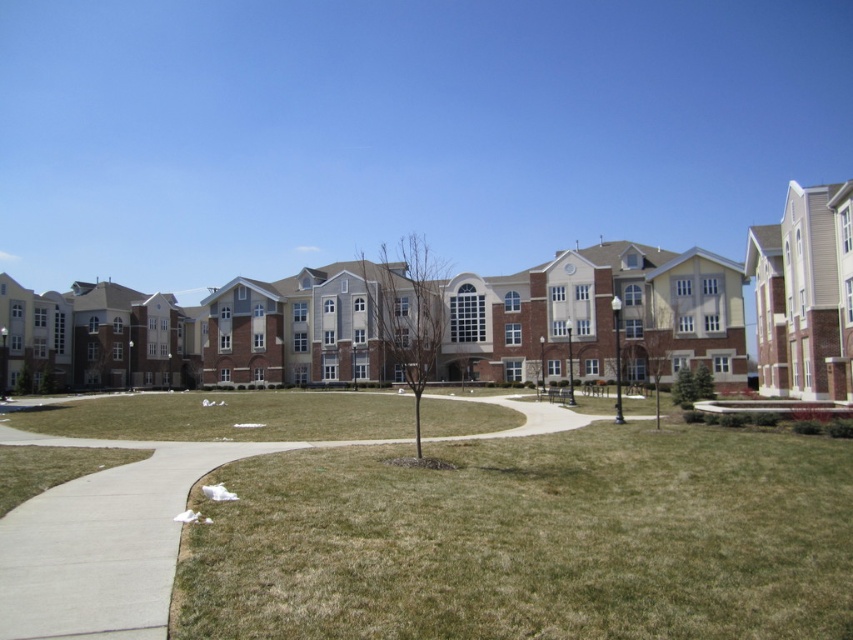
Question: Where is green grass at lower center located in relation to green grass at center in the image?

Choices:
 (A) below
 (B) above

Answer: (B)

Question: Does green grass at lower center appear over green grass at center?

Choices:
 (A) yes
 (B) no

Answer: (A)

Question: Which object appears closest to the camera in this image?

Choices:
 (A) green grass at lower center
 (B) green grass at center

Answer: (A)

Question: Does green grass at lower center appear on the left side of green grass at center?

Choices:
 (A) no
 (B) yes

Answer: (A)